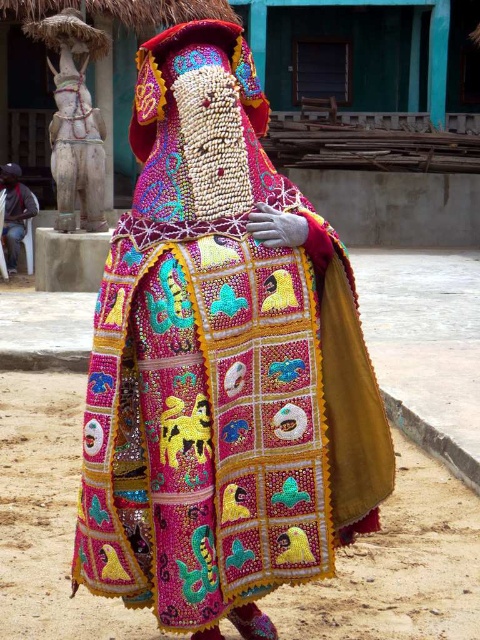
Question: Among these points, which one is farthest from the camera?

Choices:
 (A) (319, 488)
 (B) (19, 244)

Answer: (B)

Question: Which point appears closest to the camera in this image?

Choices:
 (A) (384, 470)
 (B) (1, 180)

Answer: (A)

Question: From the image, what is the correct spatial relationship of beaded fabric costume at center in relation to black fabric at lower left?

Choices:
 (A) right
 (B) left

Answer: (A)

Question: Where is beaded fabric costume at center located in relation to black fabric at lower left in the image?

Choices:
 (A) above
 (B) below

Answer: (B)

Question: In this image, where is beaded fabric costume at center located relative to black fabric at lower left?

Choices:
 (A) below
 (B) above

Answer: (A)